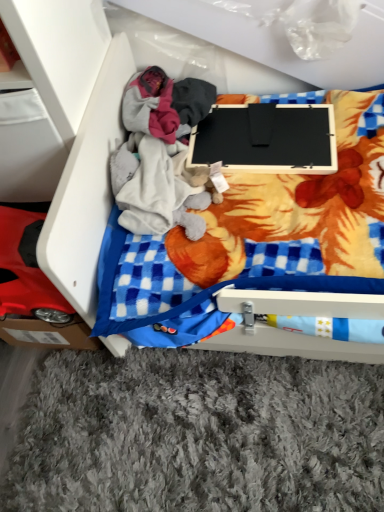
Question: Is black matte laptop at center directly adjacent to white plastic drawer at upper left?

Choices:
 (A) yes
 (B) no

Answer: (B)

Question: From the image's perspective, is black matte laptop at center above white plastic drawer at upper left?

Choices:
 (A) no
 (B) yes

Answer: (B)

Question: Does black matte laptop at center appear on the left side of white plastic drawer at upper left?

Choices:
 (A) yes
 (B) no

Answer: (B)

Question: Considering the relative positions of black matte laptop at center and white plastic drawer at upper left in the image provided, is black matte laptop at center to the right of white plastic drawer at upper left from the viewer's perspective?

Choices:
 (A) no
 (B) yes

Answer: (B)

Question: Can you confirm if black matte laptop at center is thinner than white plastic drawer at upper left?

Choices:
 (A) yes
 (B) no

Answer: (A)

Question: Is black matte laptop at center behind white plastic drawer at upper left?

Choices:
 (A) yes
 (B) no

Answer: (A)

Question: Is white plastic drawer at upper left taller than black matte laptop at center?

Choices:
 (A) no
 (B) yes

Answer: (B)

Question: Considering the relative sizes of white plastic drawer at upper left and black matte laptop at center in the image provided, is white plastic drawer at upper left wider than black matte laptop at center?

Choices:
 (A) yes
 (B) no

Answer: (A)

Question: Does white plastic drawer at upper left have a lesser width compared to black matte laptop at center?

Choices:
 (A) yes
 (B) no

Answer: (B)

Question: Is white plastic drawer at upper left positioned in front of black matte laptop at center?

Choices:
 (A) yes
 (B) no

Answer: (A)

Question: Is black matte laptop at center completely or partially inside white plastic drawer at upper left?

Choices:
 (A) yes
 (B) no

Answer: (A)

Question: Does white plastic drawer at upper left appear on the left side of black matte laptop at center?

Choices:
 (A) no
 (B) yes

Answer: (B)

Question: From a real-world perspective, is black matte laptop at center physically located above or below white plastic drawer at upper left?

Choices:
 (A) above
 (B) below

Answer: (A)